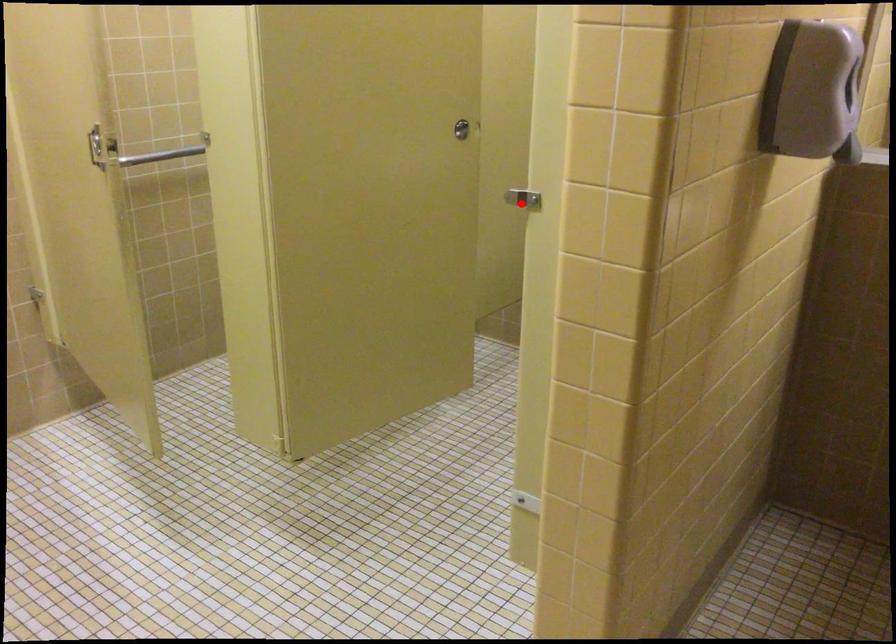
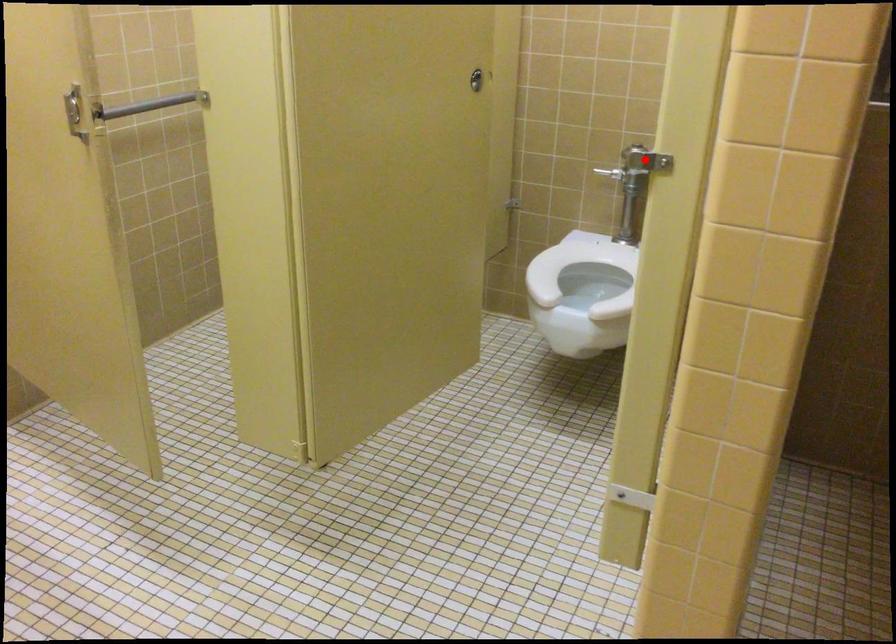
I am providing you with two images of the same scene from different viewpoints. A red point is marked on the first image and another point is marked on the second image. Is the red point in image1 aligned with the point shown in image2?

Yes